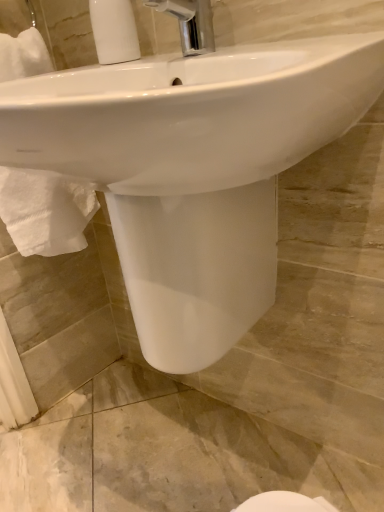
Image resolution: width=384 pixels, height=512 pixels. What do you see at coordinates (190, 23) in the screenshot? I see `chrome metallic faucet at upper center` at bounding box center [190, 23].

What are the coordinates of `white glossy sink at center` in the screenshot? It's located at (193, 170).

From their relative heights in the image, would you say white ribbed plastic at upper left is taller or shorter than white glossy sink at center?

Clearly, white ribbed plastic at upper left is shorter compared to white glossy sink at center.

From a real-world perspective, between white ribbed plastic at upper left and white glossy sink at center, who is vertically higher?

From a 3D spatial view, white ribbed plastic at upper left is above.

Is white ribbed plastic at upper left placed right next to white glossy sink at center?

They are not placed beside each other.

Which point is more distant from viewer, (124, 25) or (258, 312)?

The point (258, 312) is more distant.

From the picture: Considering the positions of objects white glossy sink at center and white ribbed plastic at upper left in the image provided, who is more to the left, white glossy sink at center or white ribbed plastic at upper left?

white ribbed plastic at upper left is more to the left.

Identify the location of sink that is in front of the white ribbed plastic at upper left. (193, 170).

Is point (208, 62) closer or farther from the camera than point (105, 24)?

Clearly, point (208, 62) is closer to the camera than point (105, 24).

Relative to white ribbed plastic at upper left, is white glossy sink at center in front or behind?

In the image, white glossy sink at center appears in front of white ribbed plastic at upper left.

Who is shorter, chrome metallic faucet at upper center or white glossy sink at center?

chrome metallic faucet at upper center is shorter.

Could you tell me if chrome metallic faucet at upper center is turned towards white glossy sink at center?

No, chrome metallic faucet at upper center is not aimed at white glossy sink at center.

Considering the relative sizes of chrome metallic faucet at upper center and white glossy sink at center in the image provided, is chrome metallic faucet at upper center bigger than white glossy sink at center?

No, chrome metallic faucet at upper center is not bigger than white glossy sink at center.

From the image's perspective, is chrome metallic faucet at upper center positioned above or below white ribbed plastic at upper left?

Based on their image positions, chrome metallic faucet at upper center is located beneath white ribbed plastic at upper left.

Is chrome metallic faucet at upper center looking in the opposite direction of white ribbed plastic at upper left?

No.

Which point is more forward, (208, 4) or (123, 15)?

The point (208, 4) is more forward.

In terms of size, does white ribbed plastic at upper left appear bigger or smaller than chrome metallic faucet at upper center?

white ribbed plastic at upper left is smaller than chrome metallic faucet at upper center.

Identify the location of soap dispenser lying on the left of chrome metallic faucet at upper center. The image size is (384, 512). click(114, 31).

Between white ribbed plastic at upper left and chrome metallic faucet at upper center, which one is positioned in front?

chrome metallic faucet at upper center is closer to the camera.

Image resolution: width=384 pixels, height=512 pixels. In order to click on tap above the white glossy sink at center (from the image's perspective) in this screenshot , I will do `click(190, 23)`.

Can you confirm if white glossy sink at center is positioned to the right of chrome metallic faucet at upper center?

No, white glossy sink at center is not to the right of chrome metallic faucet at upper center.

From a real-world perspective, is white glossy sink at center positioned over chrome metallic faucet at upper center based on gravity?

No, from a real-world perspective, white glossy sink at center is not above chrome metallic faucet at upper center.

Find the location of a particular element. Image resolution: width=384 pixels, height=512 pixels. soap dispenser that is on the left side of white glossy sink at center is located at coordinates (114, 31).

Locate an element on the screen. The width and height of the screenshot is (384, 512). sink on the right of the white ribbed plastic at upper left is located at coordinates (193, 170).

Based on the photo, estimate the real-world distances between objects in this image. Which object is closer to chrome metallic faucet at upper center, white glossy sink at center or white ribbed plastic at upper left?

Among the two, white ribbed plastic at upper left is located nearer to chrome metallic faucet at upper center.

Considering their positions, is white ribbed plastic at upper left positioned closer to white glossy sink at center than chrome metallic faucet at upper center?

Based on the image, chrome metallic faucet at upper center appears to be nearer to white glossy sink at center.

From the image, which object appears to be farther from chrome metallic faucet at upper center, white ribbed plastic at upper left or white glossy sink at center?

white glossy sink at center is further to chrome metallic faucet at upper center.

Based on their spatial positions, is chrome metallic faucet at upper center or white ribbed plastic at upper left closer to white glossy sink at center?

chrome metallic faucet at upper center is positioned closer to the anchor white glossy sink at center.

Looking at the image, which one is located closer to white ribbed plastic at upper left, chrome metallic faucet at upper center or white glossy sink at center?

chrome metallic faucet at upper center is closer to white ribbed plastic at upper left.

Based on their spatial positions, is white glossy sink at center or chrome metallic faucet at upper center further from white ribbed plastic at upper left?

white glossy sink at center lies further to white ribbed plastic at upper left than the other object.

Where is `tap between white ribbed plastic at upper left and white glossy sink at center in the up-down direction`? The height and width of the screenshot is (512, 384). tap between white ribbed plastic at upper left and white glossy sink at center in the up-down direction is located at coordinates (190, 23).